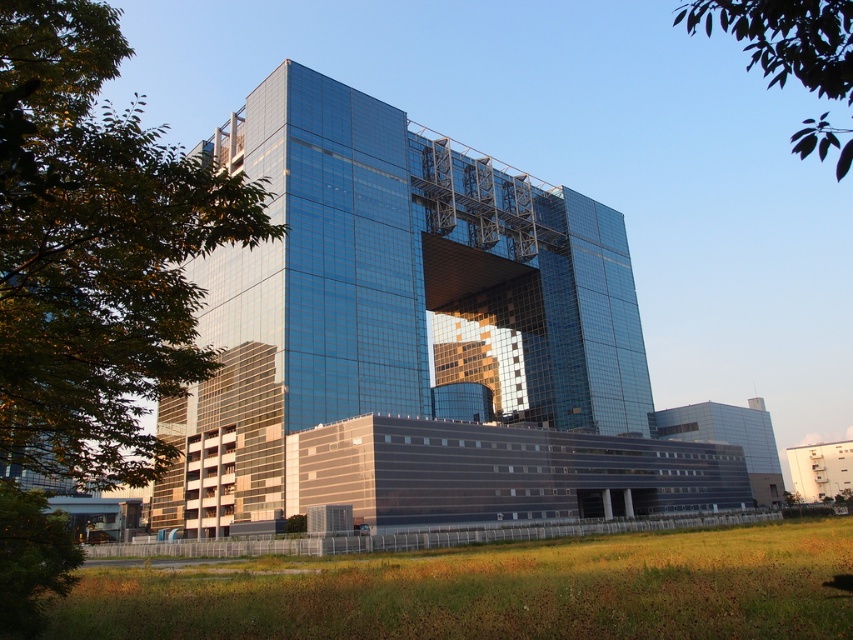
Question: Is green leafy tree at upper left to the right of green leafy tree at upper right from the viewer's perspective?

Choices:
 (A) no
 (B) yes

Answer: (A)

Question: Can you confirm if green leafy tree at upper left is thinner than green leafy tree at upper right?

Choices:
 (A) yes
 (B) no

Answer: (A)

Question: Which of the following is the farthest from the observer?

Choices:
 (A) green leafy tree at upper right
 (B) green leafy tree at upper left

Answer: (A)

Question: Which of the following is the farthest from the observer?

Choices:
 (A) green leafy tree at upper left
 (B) green leafy tree at upper right

Answer: (B)

Question: Is green leafy tree at upper left above green leafy tree at upper right?

Choices:
 (A) yes
 (B) no

Answer: (B)